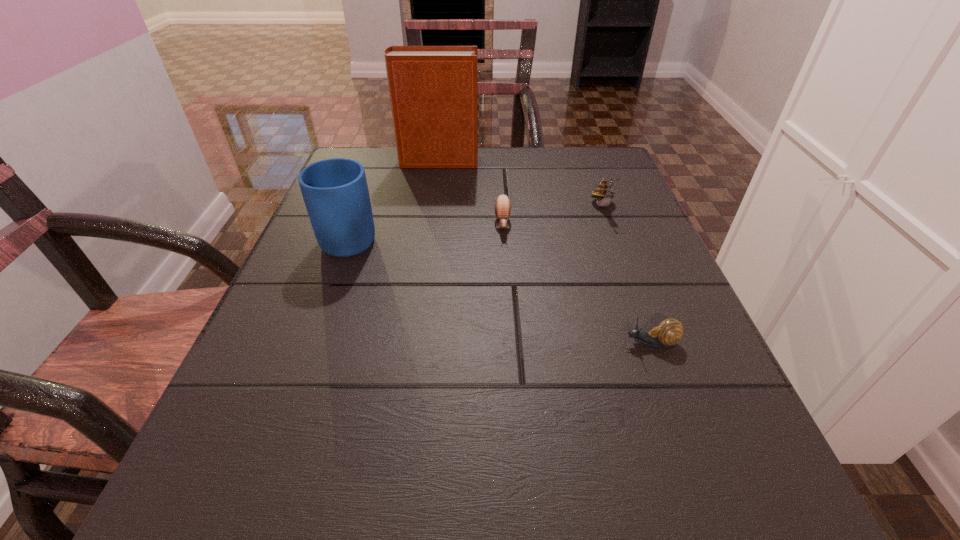
Locate an element on the screen. This screenshot has height=540, width=960. vacant area located on the side of the second tallest object with the handle is located at coordinates (382, 150).

Image resolution: width=960 pixels, height=540 pixels. What are the coordinates of `vacant region located on the face of the tallest escargot` in the screenshot? It's located at (658, 350).

Where is `vacant point located on the front-facing side of the leftmost escargot`? The width and height of the screenshot is (960, 540). vacant point located on the front-facing side of the leftmost escargot is located at coordinates (515, 408).

Locate an element on the screen. Image resolution: width=960 pixels, height=540 pixels. vacant space located 0.230m on the front-facing side of the shortest escargot is located at coordinates (470, 343).

Locate an element on the screen. The width and height of the screenshot is (960, 540). free space located on the front-facing side of the shortest escargot is located at coordinates (458, 343).

Where is `blank space located on the front-facing side of the shortest escargot`? The width and height of the screenshot is (960, 540). blank space located on the front-facing side of the shortest escargot is located at coordinates (477, 343).

The height and width of the screenshot is (540, 960). What are the coordinates of `hardback book located at the far edge` in the screenshot? It's located at pos(433,89).

You are a GUI agent. You are given a task and a screenshot of the screen. Output one action in this format:
    pyautogui.click(x=<x>, y=<y>)
    Task: Click on the snail positioned at the far edge
    This screenshot has height=540, width=960.
    Given the screenshot: What is the action you would take?
    coord(603,192)

Identify the location of hardback book that is at the left edge. The height and width of the screenshot is (540, 960). (433, 89).

The width and height of the screenshot is (960, 540). I want to click on mug that is positioned at the left edge, so click(335, 191).